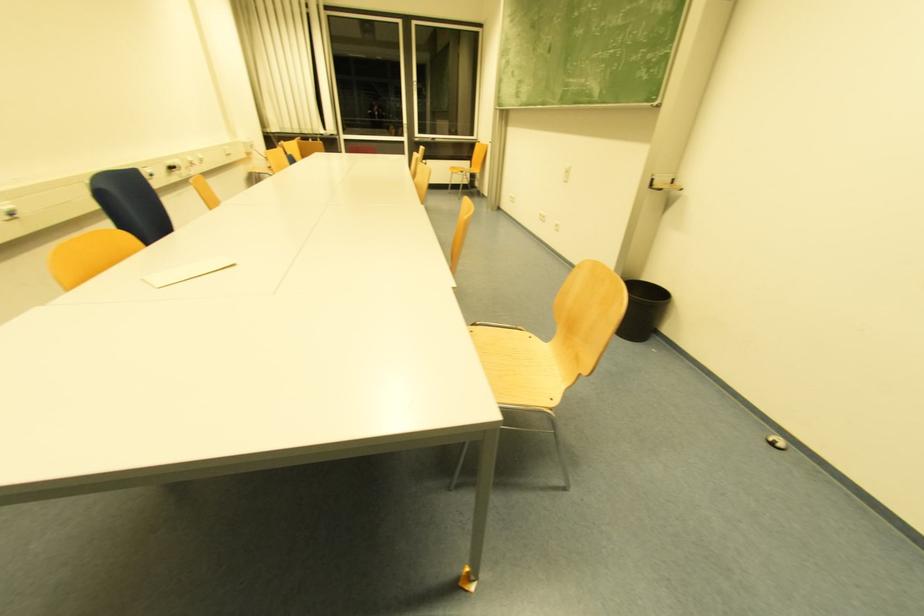
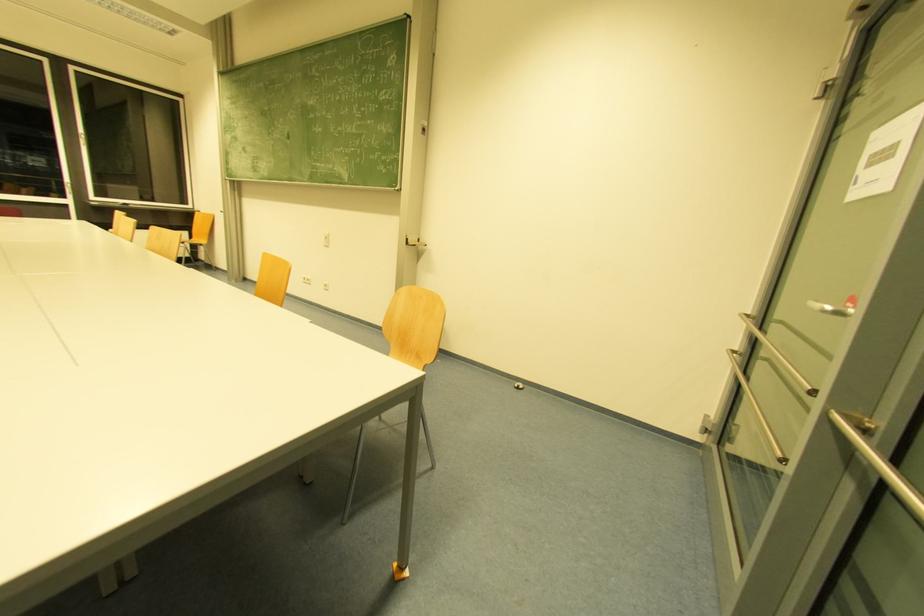
Question: The images are taken continuously from a first-person perspective. In which direction is your viewpoint rotating?

Choices:
 (A) Left
 (B) Right
 (C) Up
 (D) Down

Answer: (B)